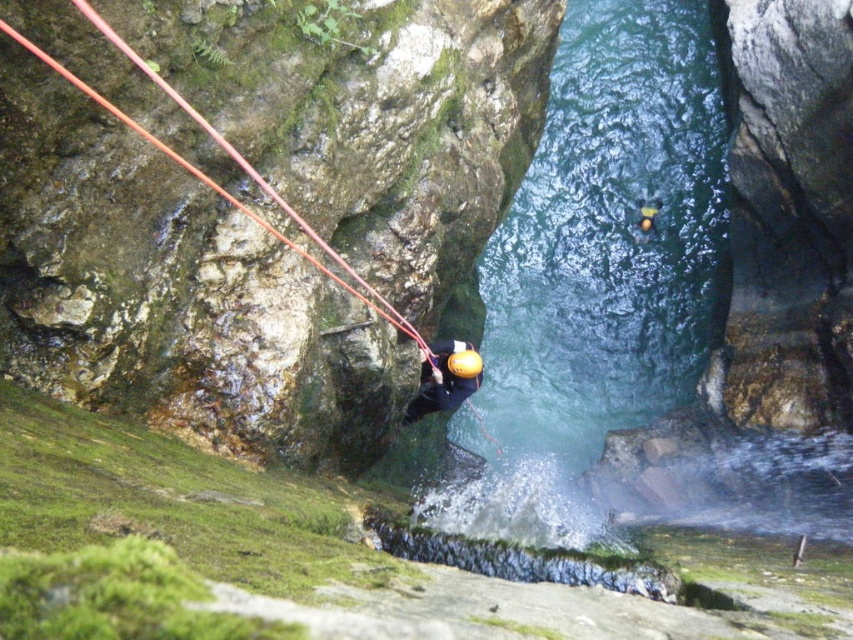
You are a safety inspector evaluating the rappelling setup. The safety guidelines state that the rope must be at least 1.5 meters away from the helmet to prevent entanglement during descent. Based on the scene, is the current distance between the smooth red rope at upper left and the matte yellow helmet at center compliant with safety standards?

The smooth red rope at upper left is 1.24 meters from the matte yellow helmet at center, which is less than the required 1.5 meters. This does not comply with safety standards as the distance is insufficient to prevent entanglement during descent.